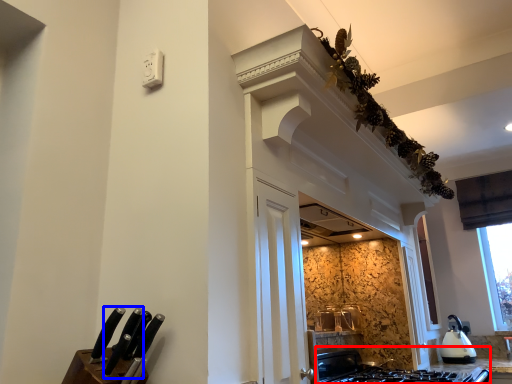
Question: Which of the following is the closest to the observer, gas stove (highlighted by a red box) or knife (highlighted by a blue box)?

Choices:
 (A) gas stove
 (B) knife

Answer: (B)